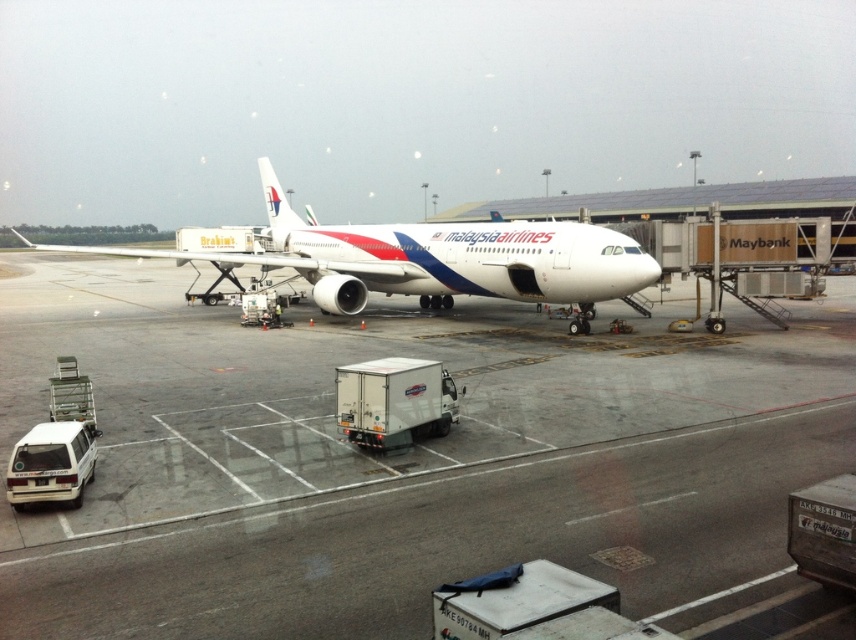
You are a ground crew member who needs to move a luggage cart from the white glossy airplane at center to the white glossy tarmac at center. Which direction should you push the cart to move it to the correct location?

The white glossy tarmac at center is positioned on the right side of the white glossy airplane at center, so you should push the luggage cart to the right to move it to the correct location.